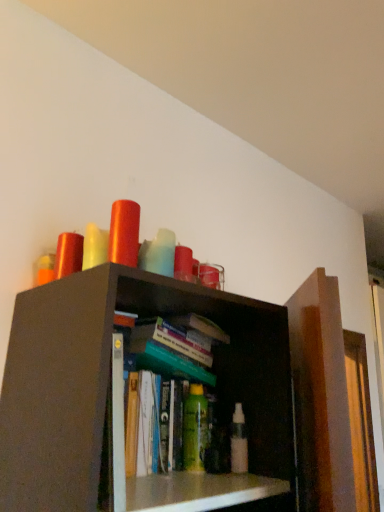
Question: Which direction should I rotate to look at white plastic spray bottle at center, which is counted as the first toiletry, starting from the right, — up or down?

Choices:
 (A) up
 (B) down

Answer: (B)

Question: Which direction should I rotate to face green matte bottle at center, the second toiletry in the right-to-left sequence, — up or down?

Choices:
 (A) down
 (B) up

Answer: (A)

Question: From a real-world perspective, is white plastic spray bottle at center, which is counted as the first toiletry, starting from the right, below green matte bottle at center, the second toiletry in the right-to-left sequence?

Choices:
 (A) no
 (B) yes

Answer: (B)

Question: Is white plastic spray bottle at center, placed as the 2th toiletry when sorted from left to right, looking in the opposite direction of green matte bottle at center, positioned as the first toiletry in left-to-right order?

Choices:
 (A) yes
 (B) no

Answer: (B)

Question: Can you confirm if white plastic spray bottle at center, which is counted as the first toiletry, starting from the right, is shorter than green matte bottle at center, the second toiletry in the right-to-left sequence?

Choices:
 (A) yes
 (B) no

Answer: (A)

Question: Is white plastic spray bottle at center, which is counted as the first toiletry, starting from the right, directly adjacent to green matte bottle at center, the second toiletry in the right-to-left sequence?

Choices:
 (A) no
 (B) yes

Answer: (B)

Question: Is white plastic spray bottle at center, placed as the 2th toiletry when sorted from left to right, far away from green matte bottle at center, the second toiletry in the right-to-left sequence?

Choices:
 (A) yes
 (B) no

Answer: (B)

Question: Could you tell me if white plastic spray bottle at center, placed as the 2th toiletry when sorted from left to right, is turned towards green matte bottle at center, positioned as the first toiletry in left-to-right order?

Choices:
 (A) yes
 (B) no

Answer: (B)

Question: Does green matte bottle at center, positioned as the first toiletry in left-to-right order, touch white plastic spray bottle at center, placed as the 2th toiletry when sorted from left to right?

Choices:
 (A) yes
 (B) no

Answer: (A)

Question: Considering the relative positions of green matte bottle at center, the second toiletry in the right-to-left sequence, and white plastic spray bottle at center, which is counted as the first toiletry, starting from the right, in the image provided, is green matte bottle at center, the second toiletry in the right-to-left sequence, to the right of white plastic spray bottle at center, which is counted as the first toiletry, starting from the right, from the viewer's perspective?

Choices:
 (A) no
 (B) yes

Answer: (A)

Question: Is the depth of green matte bottle at center, the second toiletry in the right-to-left sequence, greater than that of white plastic spray bottle at center, which is counted as the first toiletry, starting from the right?

Choices:
 (A) no
 (B) yes

Answer: (B)

Question: Would you say green matte bottle at center, positioned as the first toiletry in left-to-right order, contains white plastic spray bottle at center, placed as the 2th toiletry when sorted from left to right?

Choices:
 (A) yes
 (B) no

Answer: (B)

Question: Considering the relative positions of green matte bottle at center, the second toiletry in the right-to-left sequence, and white plastic spray bottle at center, placed as the 2th toiletry when sorted from left to right, in the image provided, is green matte bottle at center, the second toiletry in the right-to-left sequence, in front of white plastic spray bottle at center, placed as the 2th toiletry when sorted from left to right,?

Choices:
 (A) no
 (B) yes

Answer: (A)

Question: Is green matte bottle at center, the second toiletry in the right-to-left sequence, outside white plastic spray bottle at center, which is counted as the first toiletry, starting from the right?

Choices:
 (A) no
 (B) yes

Answer: (B)

Question: Is white plastic spray bottle at center, placed as the 2th toiletry when sorted from left to right, to the left or to the right of green matte bottle at center, positioned as the first toiletry in left-to-right order, in the image?

Choices:
 (A) right
 (B) left

Answer: (A)